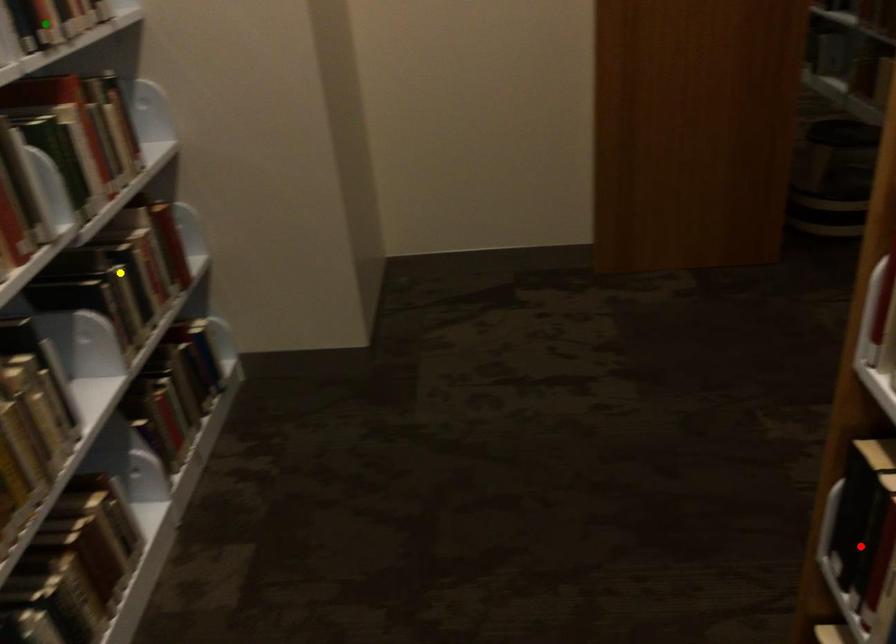
Order these from nearest to farthest:
1. green point
2. red point
3. yellow point

red point → green point → yellow point